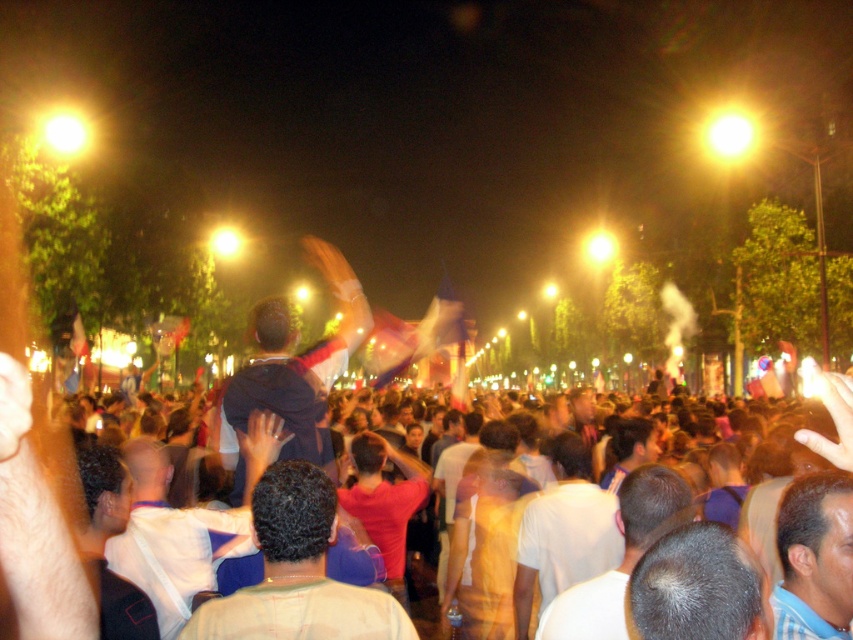
Question: Considering the relative positions of dark blue t-shirt at center and white fabric shirt at center in the image provided, where is dark blue t-shirt at center located with respect to white fabric shirt at center?

Choices:
 (A) below
 (B) above

Answer: (A)

Question: Which of these objects is positioned farthest from the dark blue t-shirt at center?

Choices:
 (A) red matte shirt at center
 (B) light brown hair at center
 (C) dark blue fabric at center

Answer: (C)

Question: Is yellow t-shirt at center to the left of red matte shirt at center from the viewer's perspective?

Choices:
 (A) no
 (B) yes

Answer: (A)

Question: Can you confirm if dark blue fabric at center is bigger than red matte shirt at center?

Choices:
 (A) yes
 (B) no

Answer: (A)

Question: Which of these objects is positioned closest to the white fabric shirt at center?

Choices:
 (A) light blue striped shirt at center
 (B) red matte shirt at center
 (C) yellow t-shirt at center

Answer: (B)

Question: Estimate the real-world distances between objects in this image. Which object is farther from the gray matte hair at center?

Choices:
 (A) dark blue fabric at center
 (B) white matte shirt at center
 (C) dark blue t-shirt at center

Answer: (A)